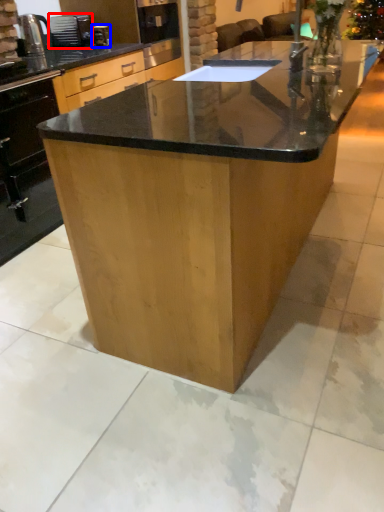
Question: Which object appears farthest to the camera in this image, appliance (highlighted by a red box) or coffee machine (highlighted by a blue box)?

Choices:
 (A) appliance
 (B) coffee machine

Answer: (A)